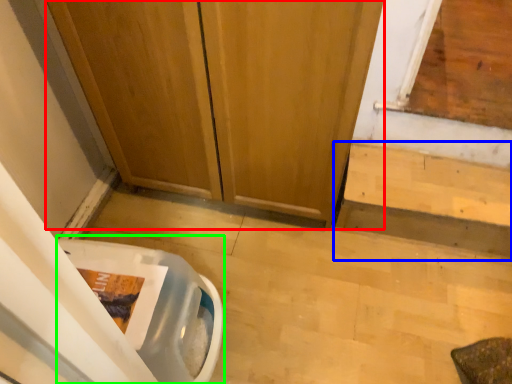
Question: Which object is positioned farthest from door (highlighted by a red box)? Select from stairwell (highlighted by a blue box) and toilet bowl (highlighted by a green box).

Choices:
 (A) stairwell
 (B) toilet bowl

Answer: (B)